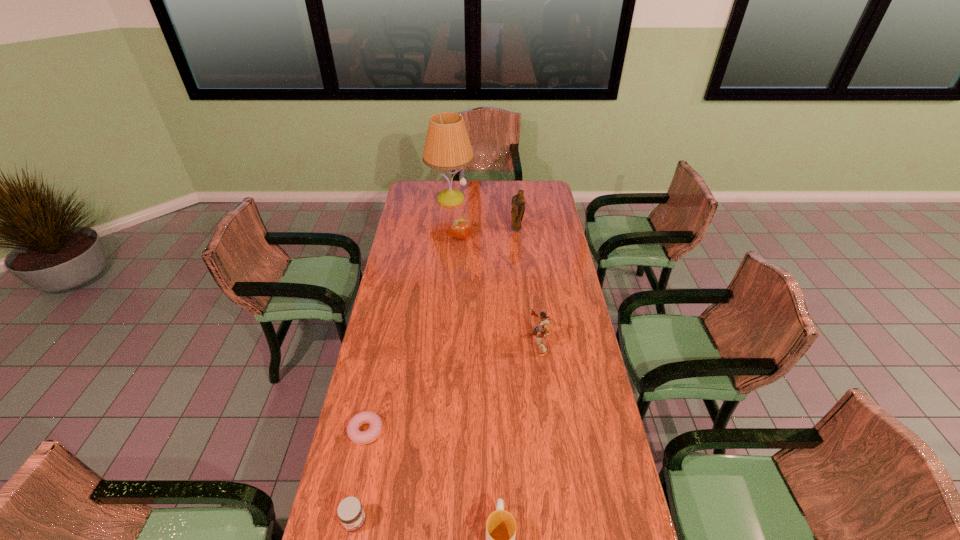
Identify the location of vacant space located on the front-facing side of the sixth shortest object. This screenshot has width=960, height=540. (522, 280).

This screenshot has width=960, height=540. Identify the location of vacant space located 0.380m on the front-facing side of the fourth nearest object. (431, 344).

Identify the location of vacant area situated 0.180m on the front-facing side of the fourth nearest object. (482, 344).

Image resolution: width=960 pixels, height=540 pixels. Find the location of `free location located 0.090m on the front-facing side of the fourth nearest object`. free location located 0.090m on the front-facing side of the fourth nearest object is located at coordinates (505, 344).

Where is `vacant region located 0.110m on the right of the apple`? The width and height of the screenshot is (960, 540). vacant region located 0.110m on the right of the apple is located at coordinates (493, 238).

The image size is (960, 540). I want to click on vacant position located on the right of the fifth farthest object, so click(x=468, y=430).

The width and height of the screenshot is (960, 540). I want to click on object situated at the far edge, so click(x=447, y=147).

You are a GUI agent. You are given a task and a screenshot of the screen. Output one action in this format:
    pyautogui.click(x=<x>, y=<y>)
    Task: Click on the lamp positioned at the left edge
    
    Given the screenshot: What is the action you would take?
    pyautogui.click(x=447, y=147)

I want to click on jam that is at the left edge, so coord(351,514).

Identify the location of doughnut present at the left edge. The image size is (960, 540). (355, 435).